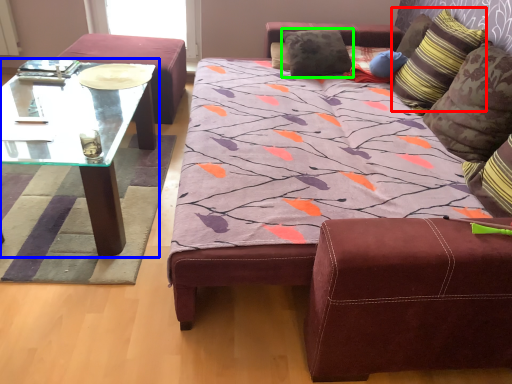
Question: Which object is the farthest from pillow (highlighted by a red box)? Choose among these: coffee table (highlighted by a blue box) or pillow (highlighted by a green box).

Choices:
 (A) coffee table
 (B) pillow

Answer: (A)